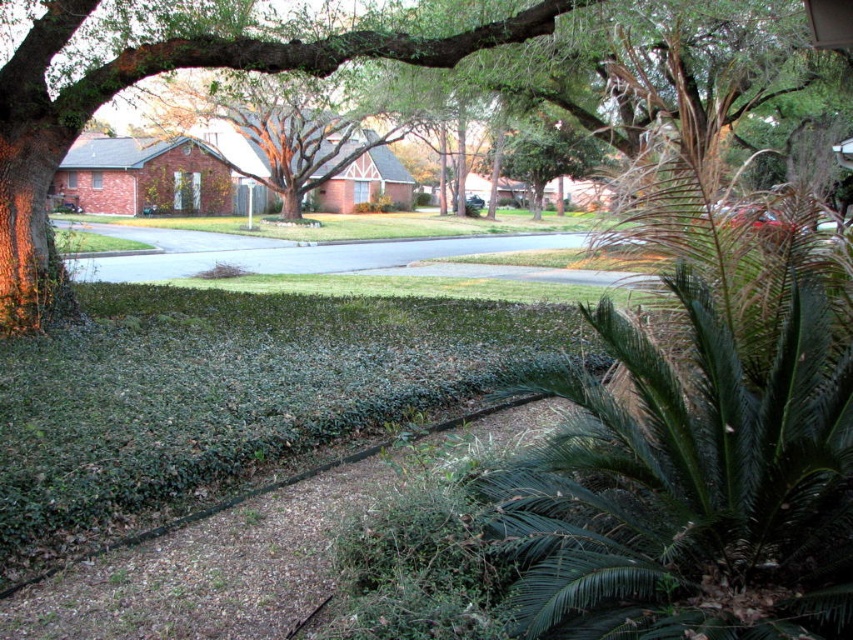
Question: Does green leafy palm at lower right appear on the left side of gray asphalt road at center?

Choices:
 (A) no
 (B) yes

Answer: (A)

Question: Which object is positioned farthest from the green leafy tree at center?

Choices:
 (A) green leafy palm at lower right
 (B) gray asphalt road at center

Answer: (B)

Question: Which of these objects is positioned farthest from the green leafy tree at center?

Choices:
 (A) green leafy palm at lower right
 (B) gray asphalt road at center

Answer: (B)

Question: Is green leafy palm at lower right to the left of green leafy tree at center from the viewer's perspective?

Choices:
 (A) yes
 (B) no

Answer: (B)

Question: Does green leafy palm at lower right appear on the left side of gray asphalt road at center?

Choices:
 (A) yes
 (B) no

Answer: (B)

Question: Among these objects, which one is nearest to the camera?

Choices:
 (A) gray asphalt road at center
 (B) green leafy palm at lower right
 (C) green leafy tree at center

Answer: (B)